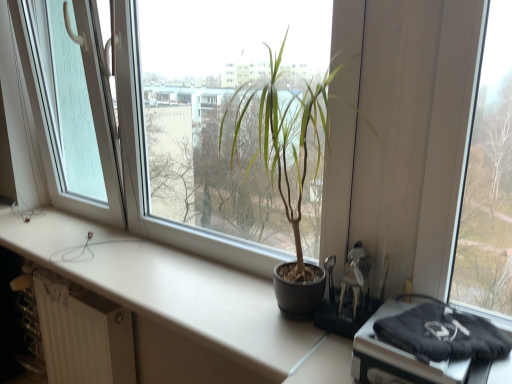
You are a GUI agent. You are given a task and a screenshot of the screen. Output one action in this format:
    pyautogui.click(x=<x>, y=<y>)
    Task: Click on the vacant region to the left of matte black pot at center
    
    Given the screenshot: What is the action you would take?
    pyautogui.click(x=194, y=304)